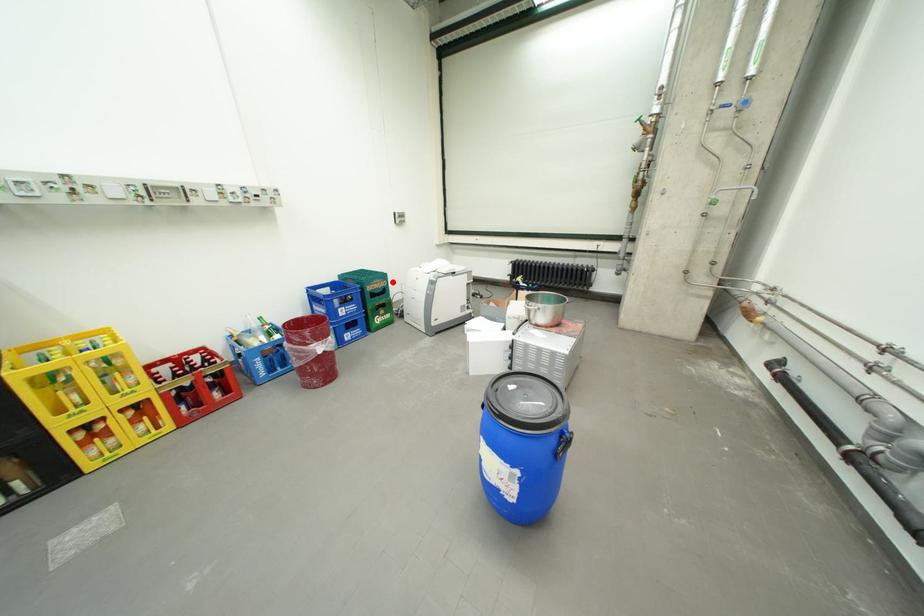
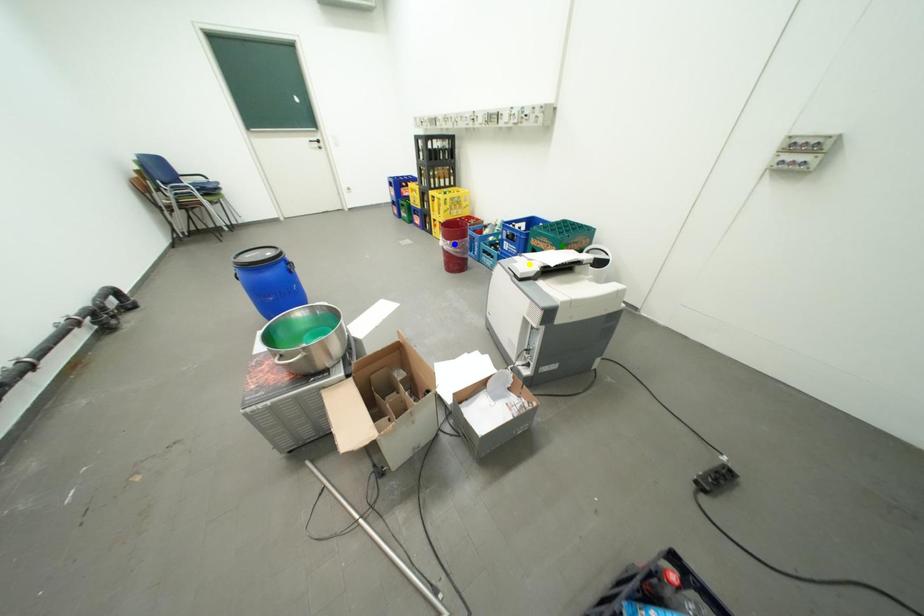
Question: I am providing you with two images of the same scene from different viewpoints. A red point is marked on the first image. You are given multiple points on the second image. Which mark in image 2 goes with the point in image 1?

Choices:
 (A) green point
 (B) yellow point
 (C) blue point

Answer: (A)